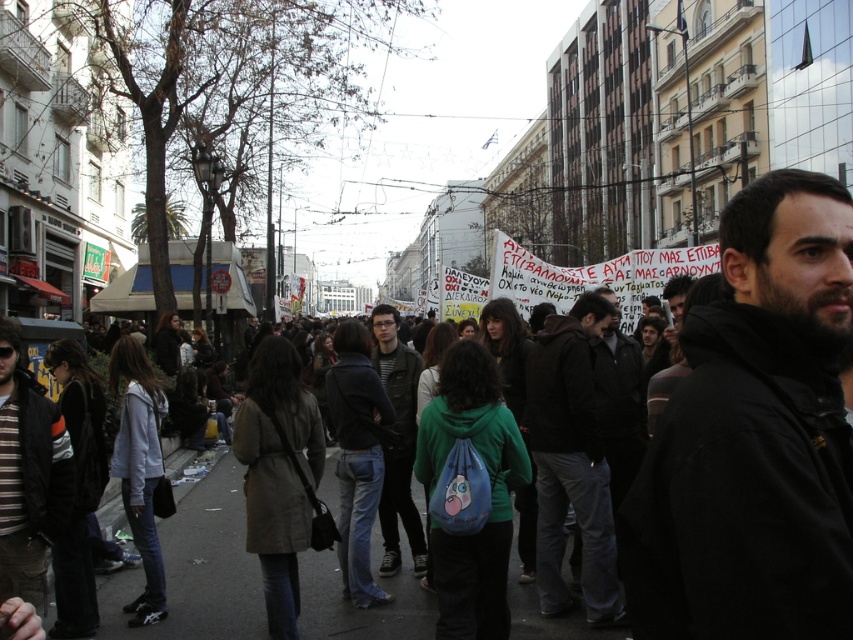
Question: Is black matte jacket at center below dark gray pants at center?

Choices:
 (A) yes
 (B) no

Answer: (B)

Question: Which object is positioned farthest from the black matte jacket at center?

Choices:
 (A) striped cotton shirt at left
 (B) dark green jacket at center

Answer: (B)

Question: Does black matte jacket at center appear on the right side of dark green jacket at center?

Choices:
 (A) yes
 (B) no

Answer: (A)

Question: Which of the following is the closest to the observer?

Choices:
 (A) striped cotton shirt at left
 (B) dark green jacket at center
 (C) dark gray pants at center

Answer: (A)

Question: Which of the following is the closest to the observer?

Choices:
 (A) (x=850, y=608)
 (B) (x=604, y=314)

Answer: (A)

Question: Is dark gray pants at center wider than dark green jacket at center?

Choices:
 (A) yes
 (B) no

Answer: (A)